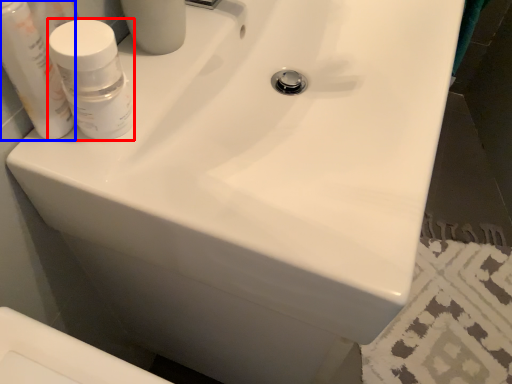
Question: Which point is closer to the camera, mouthwash (highlighted by a red box) or mouthwash (highlighted by a blue box)?

Choices:
 (A) mouthwash
 (B) mouthwash

Answer: (B)